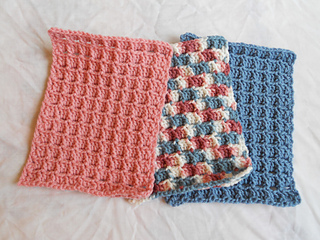
Locate an element on the screen. right white bedding is located at coordinates (304, 120).